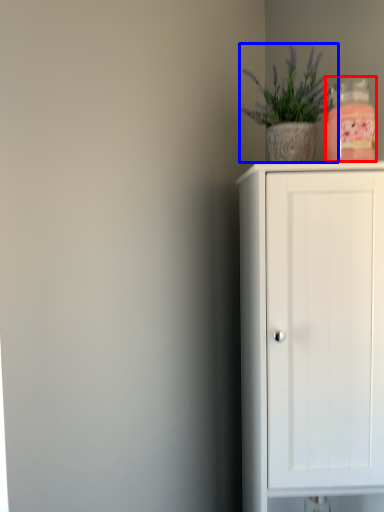
Question: Which point is closer to the camera, bottle (highlighted by a red box) or houseplant (highlighted by a blue box)?

Choices:
 (A) bottle
 (B) houseplant

Answer: (A)